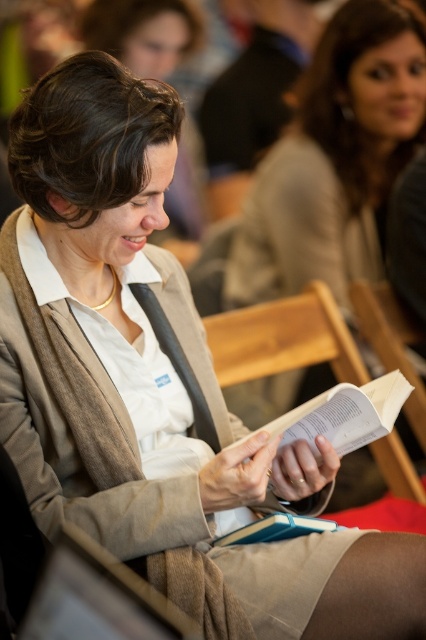
You are a tailor measuring for a new chair cover. The wooden chair at center is 40 cm wide. Can the beige woolen cardigan at center fit over the chair without being stretched?

The beige woolen cardigan at center might be wider than the wooden chair at center, so it could potentially fit without stretching if the cardigan is indeed wider. However, since the exact width isn not provided, the tailor should measure both to confirm.

You are an interior designer assessing seating comfort in a public space. You observe the beige woolen cardigan at center and the wooden chair at center. Which object is taller?

The beige woolen cardigan at center is much taller than the wooden chair at center.